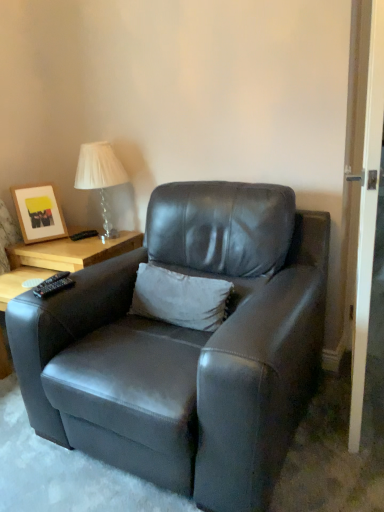
Question: Considering their positions, is clear glass table lamp at upper left located in front of or behind matte wooden picture frame at upper left?

Choices:
 (A) behind
 (B) front

Answer: (B)

Question: From their relative heights in the image, would you say clear glass table lamp at upper left is taller or shorter than matte wooden picture frame at upper left?

Choices:
 (A) short
 (B) tall

Answer: (B)

Question: Which object is the closest to the white wood screen door at right?

Choices:
 (A) clear glass table lamp at upper left
 (B) matte black armchair at center
 (C) black plastic remote at lower left
 (D) matte wooden picture frame at upper left
 (E) white soft pillow at center

Answer: (B)

Question: Considering the real-world distances, which object is closest to the clear glass table lamp at upper left?

Choices:
 (A) black plastic remote at lower left
 (B) white soft pillow at center
 (C) matte black armchair at center
 (D) matte wooden picture frame at upper left
 (E) white wood screen door at right

Answer: (D)